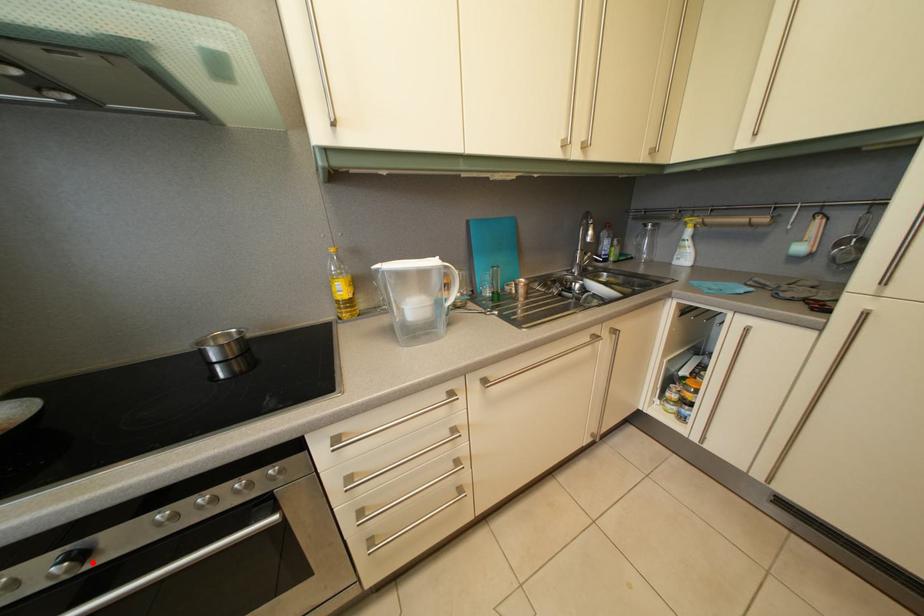
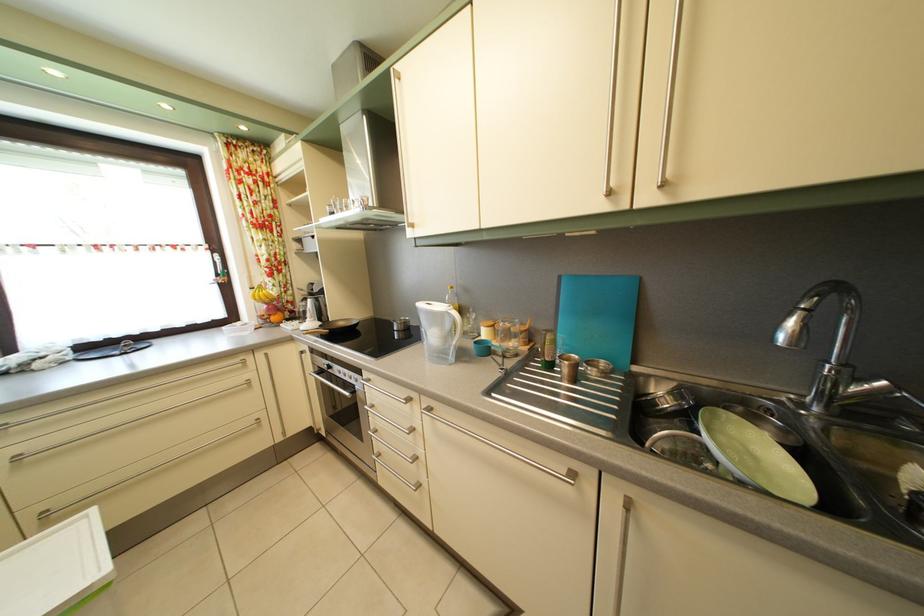
Where in the second image is the point corresponding to the highlighted location from the first image?

(337, 374)